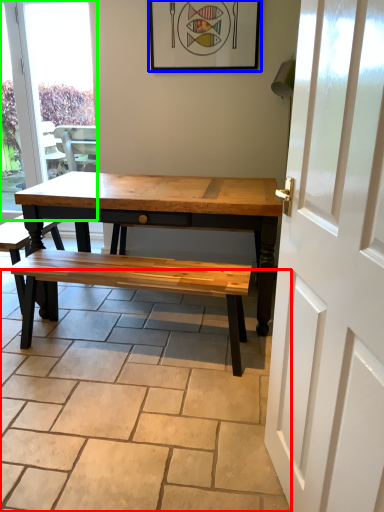
Question: Estimate the real-world distances between objects in this image. Which object is closer to path (highlighted by a red box), picture frame (highlighted by a blue box) or window (highlighted by a green box)?

Choices:
 (A) picture frame
 (B) window

Answer: (A)